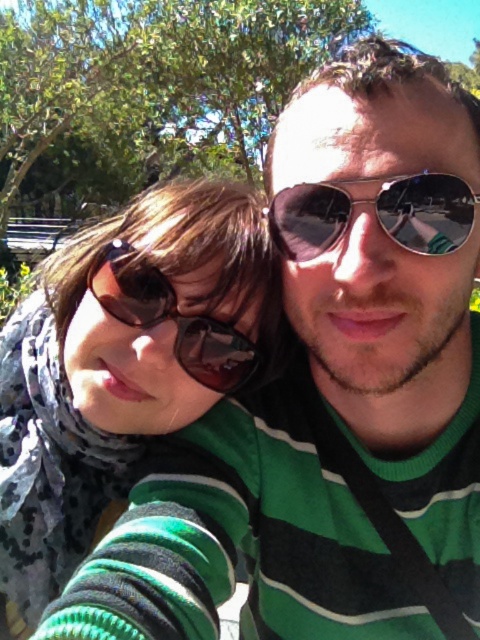
Question: Which point is closer to the camera?

Choices:
 (A) (454, 241)
 (B) (190, 204)
 (C) (230, 358)

Answer: (A)

Question: Is metallic aviator sunglasses at center positioned at the back of brown reflective sunglasses at left?

Choices:
 (A) no
 (B) yes

Answer: (A)

Question: Is metallic aviator sunglasses at center below brown reflective sunglasses at left?

Choices:
 (A) no
 (B) yes

Answer: (A)

Question: Which of the following is the closest to the observer?

Choices:
 (A) click(x=215, y=289)
 (B) click(x=297, y=234)

Answer: (B)

Question: In this image, where is matte black sunglasses at upper left located relative to metallic aviator sunglasses at center?

Choices:
 (A) left
 (B) right

Answer: (A)

Question: Which object is farther from the camera taking this photo?

Choices:
 (A) brown reflective sunglasses at left
 (B) matte black sunglasses at upper left
 (C) metallic aviator sunglasses at center

Answer: (B)